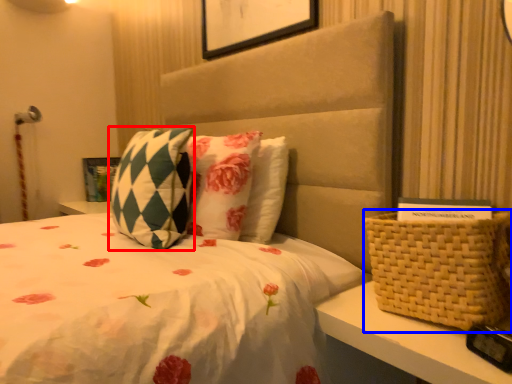
Question: Among these objects, which one is nearest to the camera, pillow (highlighted by a red box) or basket (highlighted by a blue box)?

Choices:
 (A) pillow
 (B) basket

Answer: (B)